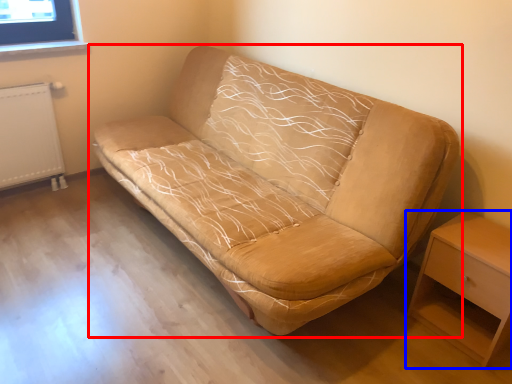
Question: Which of the following is the closest to the observer, studio couch (highlighted by a red box) or nightstand (highlighted by a blue box)?

Choices:
 (A) studio couch
 (B) nightstand

Answer: (A)